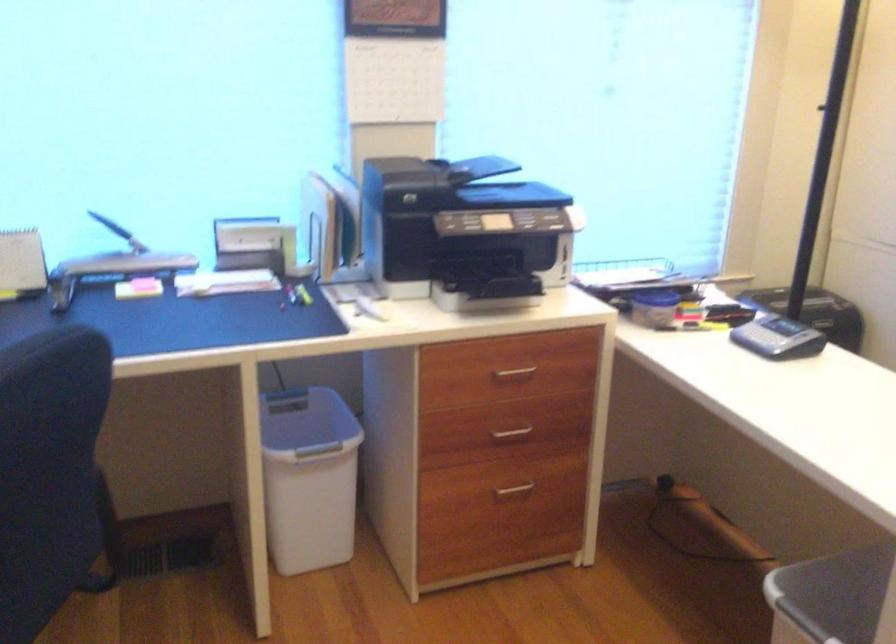
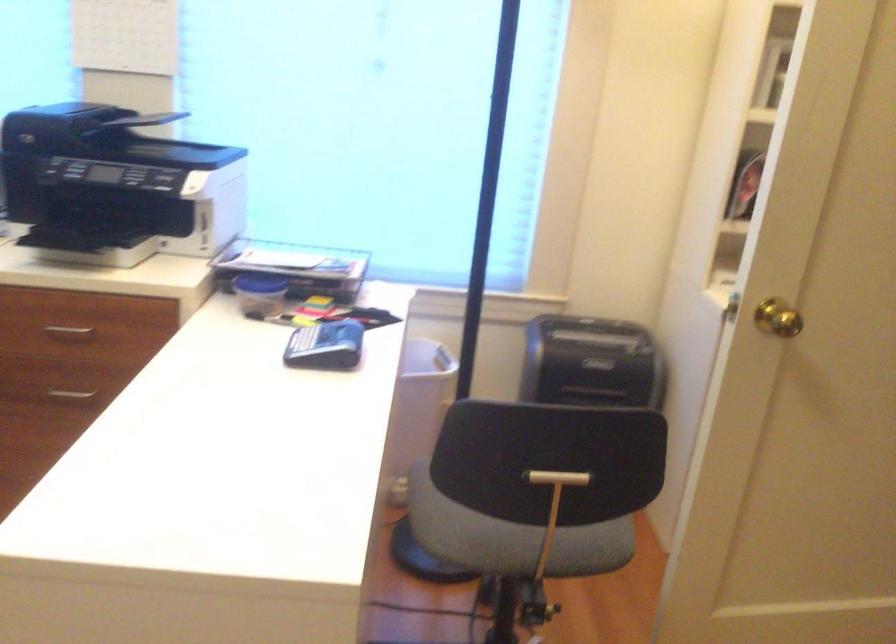
Where in the second image is the point corresponding to [513,374] from the first image?

(69, 332)